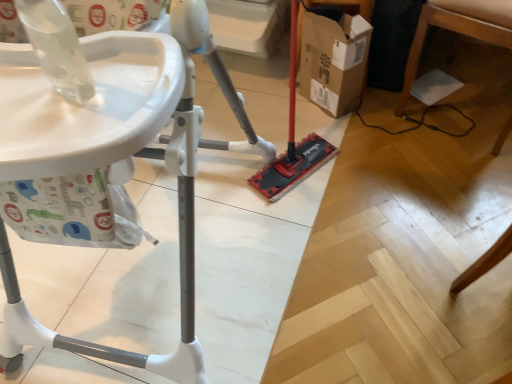
Question: From the image's perspective, is white plastic high chair at left, the second furniture positioned from the right, beneath wooden table leg at lower right, the 1th furniture positioned from the right?

Choices:
 (A) no
 (B) yes

Answer: (B)

Question: From the image's perspective, is white plastic high chair at left, which appears as the 1th furniture when viewed from the left, located above wooden table leg at lower right, which is counted as the 2th furniture, starting from the left?

Choices:
 (A) no
 (B) yes

Answer: (A)

Question: Can you confirm if white plastic high chair at left, the second furniture positioned from the right, is thinner than wooden table leg at lower right, which is counted as the 2th furniture, starting from the left?

Choices:
 (A) no
 (B) yes

Answer: (A)

Question: Is white plastic high chair at left, the second furniture positioned from the right, directly adjacent to wooden table leg at lower right, the 1th furniture positioned from the right?

Choices:
 (A) yes
 (B) no

Answer: (B)

Question: Are white plastic high chair at left, which appears as the 1th furniture when viewed from the left, and wooden table leg at lower right, the 1th furniture positioned from the right, located far from each other?

Choices:
 (A) yes
 (B) no

Answer: (A)

Question: Is white plastic high chair at left, which appears as the 1th furniture when viewed from the left, located outside wooden table leg at lower right, which is counted as the 2th furniture, starting from the left?

Choices:
 (A) no
 (B) yes

Answer: (B)

Question: Is white plastic high chair at left, which appears as the 1th furniture when viewed from the left, facing towards cardboard box at center?

Choices:
 (A) yes
 (B) no

Answer: (B)

Question: Is the position of white plastic high chair at left, which appears as the 1th furniture when viewed from the left, less distant than that of cardboard box at center?

Choices:
 (A) yes
 (B) no

Answer: (A)

Question: From the image's perspective, is white plastic high chair at left, which appears as the 1th furniture when viewed from the left, below cardboard box at center?

Choices:
 (A) no
 (B) yes

Answer: (B)

Question: Is white plastic high chair at left, the second furniture positioned from the right, turned away from cardboard box at center?

Choices:
 (A) no
 (B) yes

Answer: (B)

Question: Does white plastic high chair at left, which appears as the 1th furniture when viewed from the left, have a lesser width compared to cardboard box at center?

Choices:
 (A) no
 (B) yes

Answer: (A)

Question: From the image's perspective, is white plastic high chair at left, which appears as the 1th furniture when viewed from the left, located above cardboard box at center?

Choices:
 (A) no
 (B) yes

Answer: (A)

Question: Is wooden table leg at lower right, which is counted as the 2th furniture, starting from the left, shorter than white plastic high chair at left, which appears as the 1th furniture when viewed from the left?

Choices:
 (A) no
 (B) yes

Answer: (B)